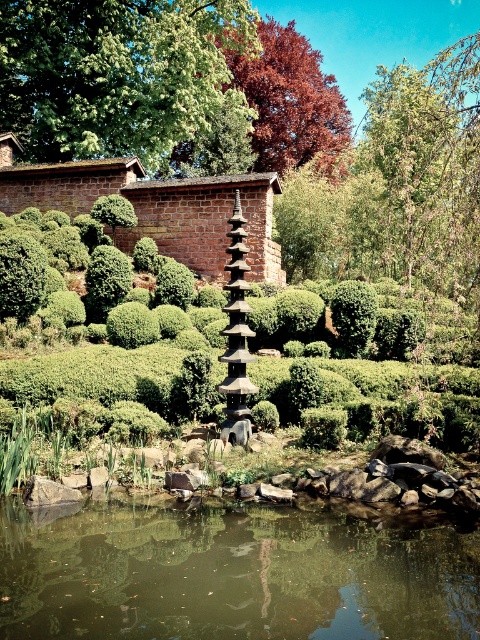
Question: From the image, what is the correct spatial relationship of brown reflective water at center in relation to green leafy tree at upper center?

Choices:
 (A) below
 (B) above

Answer: (A)

Question: Which of the following is the farthest from the observer?

Choices:
 (A) shiny red leaves at upper center
 (B) green leafy tree at upper center
 (C) brown reflective water at center

Answer: (A)

Question: Which point is farther to the camera?

Choices:
 (A) green leafy tree at upper center
 (B) brown reflective water at center
 (C) shiny red leaves at upper center

Answer: (C)

Question: Which object appears farthest from the camera in this image?

Choices:
 (A) brown reflective water at center
 (B) shiny red leaves at upper center
 (C) green leafy tree at upper center

Answer: (B)

Question: Does brown reflective water at center appear under shiny red leaves at upper center?

Choices:
 (A) yes
 (B) no

Answer: (A)

Question: Can you confirm if brown reflective water at center is positioned to the left of green leafy tree at upper center?

Choices:
 (A) no
 (B) yes

Answer: (A)